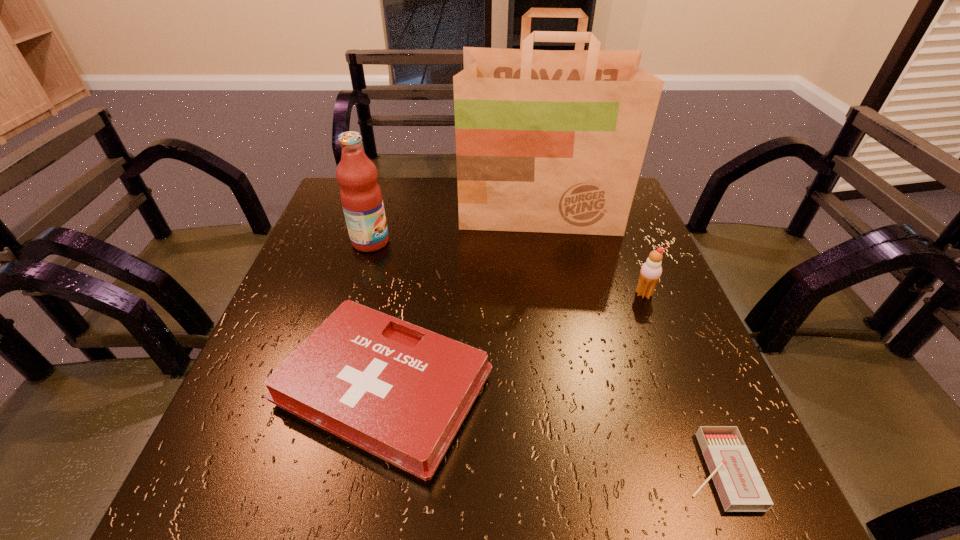
The width and height of the screenshot is (960, 540). In order to click on free space between the icecream and the matchbox in this screenshot , I will do `click(680, 382)`.

Where is `free spot between the icecream and the tallest object`? The width and height of the screenshot is (960, 540). free spot between the icecream and the tallest object is located at coordinates (591, 252).

Locate an element on the screen. unoccupied area between the shortest object and the tallest object is located at coordinates (628, 340).

Identify the location of vacant area that lies between the first-aid kit and the shortest object. (550, 430).

At what (x,y) coordinates should I click in order to perform the action: click on free spot between the shortest object and the tallest object. Please return your answer as a coordinate pair (x, y). The height and width of the screenshot is (540, 960). Looking at the image, I should click on (628, 340).

Locate an element on the screen. The image size is (960, 540). vacant area between the tallest object and the fourth tallest object is located at coordinates (462, 299).

Where is `free space between the grocery bag and the third tallest object`? The height and width of the screenshot is (540, 960). free space between the grocery bag and the third tallest object is located at coordinates (591, 252).

Locate an element on the screen. This screenshot has width=960, height=540. empty space that is in between the matchbox and the tallest object is located at coordinates (628, 340).

Identify the location of object that is the third closest one to the tallest object. (401, 392).

I want to click on the third closest object to the first-aid kit, so click(740, 487).